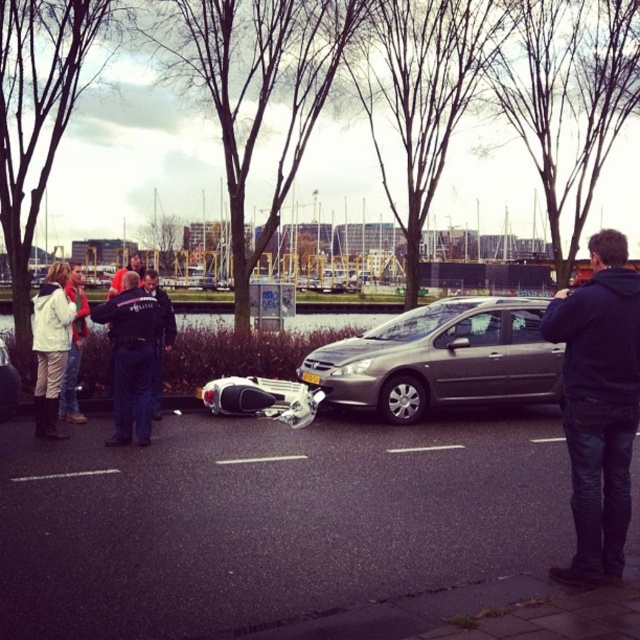
Can you confirm if black uniformed officer at center is positioned to the right of metallic silver motorcycle at lower left?

Yes, black uniformed officer at center is to the right of metallic silver motorcycle at lower left.

Is point (108, 323) closer to viewer compared to point (0, 416)?

No.

Find the location of a particular element. The image size is (640, 640). black uniformed officer at center is located at coordinates (131, 356).

Can you confirm if dark blue hoodie at right is positioned below white matte jacket at left?

Correct, dark blue hoodie at right is located below white matte jacket at left.

Can you confirm if dark blue hoodie at right is shorter than white matte jacket at left?

No.

Describe the element at coordinates (598, 404) in the screenshot. The image size is (640, 640). I see `dark blue hoodie at right` at that location.

Find the location of a particular element. dark blue hoodie at right is located at coordinates (598, 404).

Does point (36, 385) come closer to viewer compared to point (6, 348)?

Yes, it is.

Locate an element on the screen. Image resolution: width=640 pixels, height=640 pixels. white matte jacket at left is located at coordinates (51, 348).